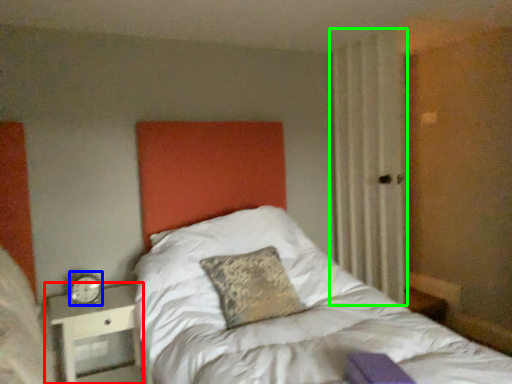
Question: Which object is the farthest from nightstand (highlighted by a red box)? Choose among these: alarm clock (highlighted by a blue box) or curtain (highlighted by a green box).

Choices:
 (A) alarm clock
 (B) curtain

Answer: (B)